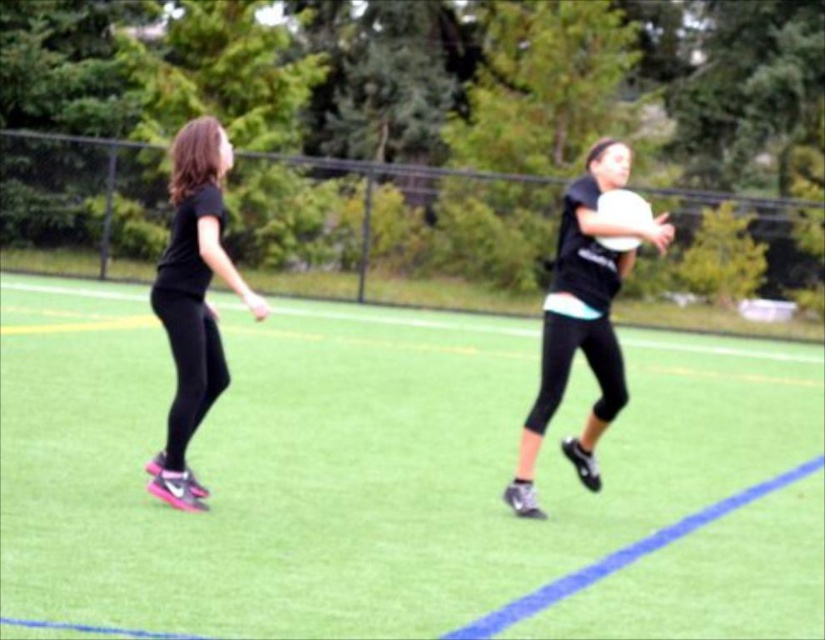
Does green artificial turf at center have a smaller size compared to black matte leggings at left?

No, green artificial turf at center is not smaller than black matte leggings at left.

What do you see at coordinates (349, 461) in the screenshot?
I see `green artificial turf at center` at bounding box center [349, 461].

Locate an element on the screen. green artificial turf at center is located at coordinates (349, 461).